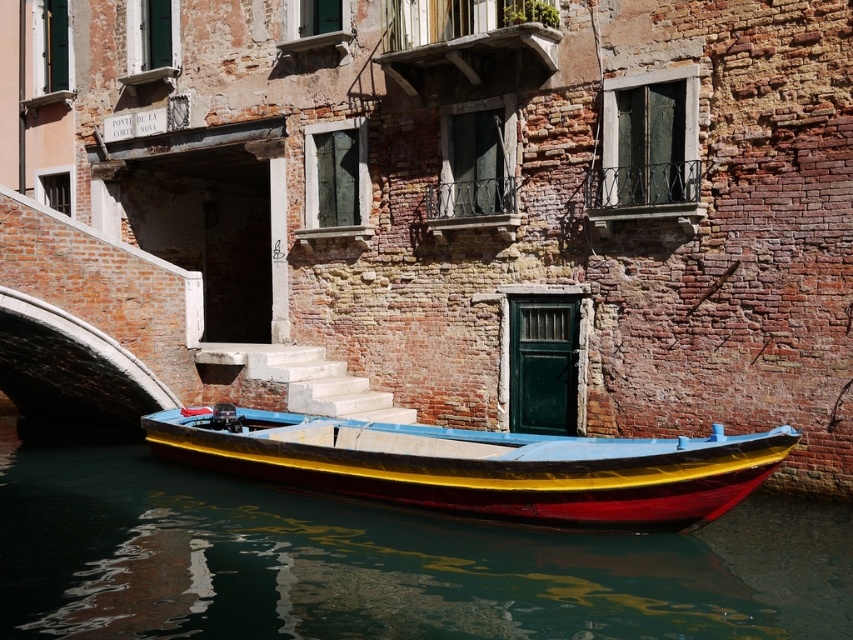
Does point (618, 596) lie in front of point (587, 476)?

Yes, it is in front of point (587, 476).

Does smooth water at boat center lie in front of shiny wood boat at center?

Yes, smooth water at boat center is in front of shiny wood boat at center.

Which is in front, point (508, 620) or point (729, 488)?

Positioned in front is point (508, 620).

Image resolution: width=853 pixels, height=640 pixels. Find the location of `smooth water at boat center`. smooth water at boat center is located at coordinates (378, 561).